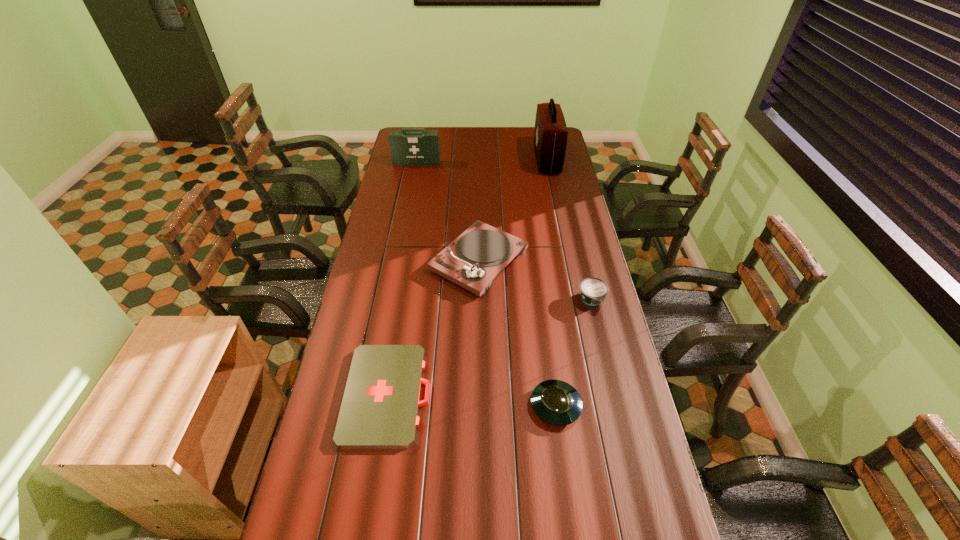
Where is `object that is positioned at the far right corner`? This screenshot has width=960, height=540. object that is positioned at the far right corner is located at coordinates (550, 136).

Where is `free space at the far edge of the desktop`? The image size is (960, 540). free space at the far edge of the desktop is located at coordinates 462,133.

Image resolution: width=960 pixels, height=540 pixels. In the image, there is a desktop. Identify the location of vacant space at the left edge. (403, 248).

The width and height of the screenshot is (960, 540). In order to click on vacant space at the right edge of the desktop in this screenshot , I will do `click(574, 314)`.

At what (x,y) coordinates should I click in order to perform the action: click on vacant space that's between the third tallest object and the yogurt. Please return your answer as a coordinate pair (x, y). The image size is (960, 540). Looking at the image, I should click on (535, 280).

Identify the location of free spot between the shortest object and the saucer. (471, 400).

Identify the location of free space between the nearest first-aid kit and the phonograph_record. This screenshot has height=540, width=960. (433, 327).

Identify the location of free space between the saucer and the yogurt. This screenshot has width=960, height=540. (574, 353).

The width and height of the screenshot is (960, 540). In order to click on blank region between the nearest first-aid kit and the yogurt in this screenshot , I will do `click(490, 347)`.

The width and height of the screenshot is (960, 540). I want to click on empty space that is in between the fourth shortest object and the saucer, so click(x=517, y=333).